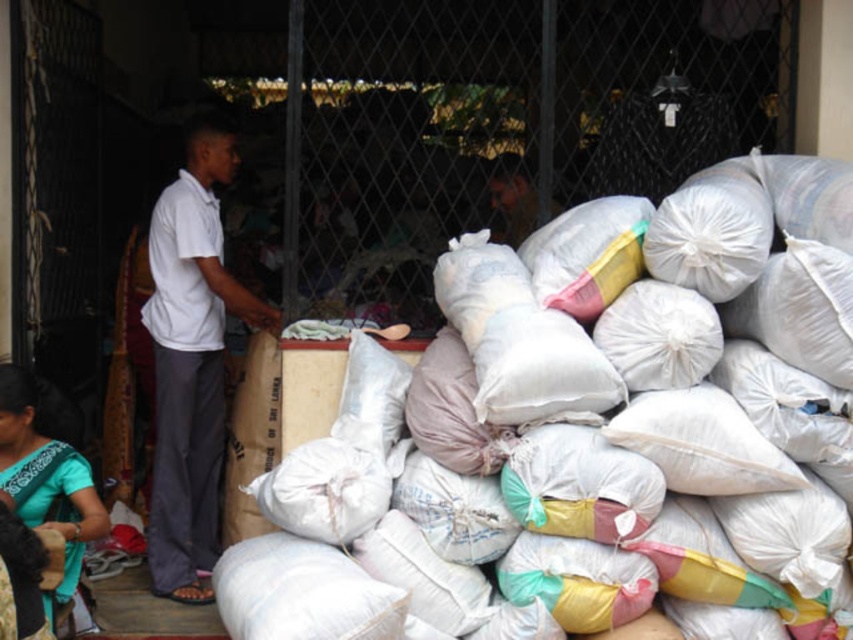
You are a delivery person who needs to place a new sack on the right side of the white cotton shirt at left. Where should you place the new sack in relation to the existing white fabric sack at center?

The white fabric sack at center is already to the right of the white cotton shirt at left. Therefore, placing the new sack to the right of the white fabric sack at center would ensure it is on the correct side relative to the white cotton shirt at left.

You are a delivery person who needs to place a new sack on top of the existing sacks. The new sack must be placed in a position that is above the white cotton shirt at left but not overlapping with the white fabric sack at center. Is this possible given the current arrangement?

The white fabric sack at center is located below the white cotton shirt at left, so placing the new sack above the white cotton shirt at left would mean placing it higher than the current position of the white fabric sack at center. Since the sacks form a mound, there is likely space above the white cotton shirt at left to place the new sack without overlapping the white fabric sack at center.